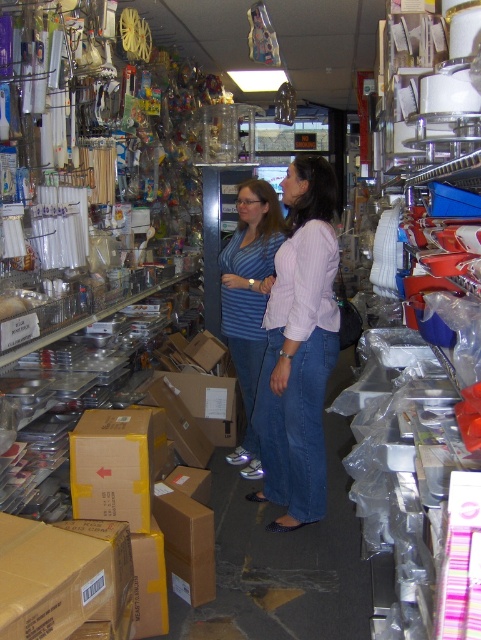
In the scene shown: You are a store employee who needs to restock a small display shelf. You see the light purple shirt at center and the blue striped shirt at center. Which shirt should you choose to fit better on the small display shelf?

The light purple shirt at center has a smaller size compared to the blue striped shirt at center, so it will fit better on the small display shelf.

You are standing in the store and want to find the blue striped shirt at center. Based on the coordinates given, where should you look relative to the center of the image?

The blue striped shirt at center is located at coordinates approximately 0.470 on the x and 0.518 on the y, which is slightly to the right and above the center point of the image.